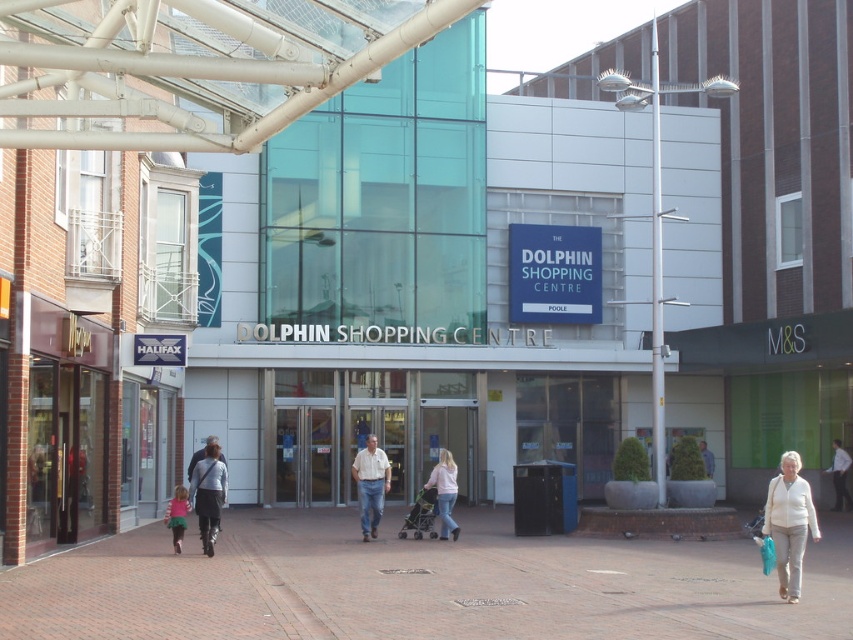
Can you confirm if light pink fabric stroller at center is wider than matte pink dress at lower left?

In fact, light pink fabric stroller at center might be narrower than matte pink dress at lower left.

Who is more forward, (439, 456) or (177, 547)?

Point (177, 547)

I want to click on light pink fabric stroller at center, so click(444, 492).

Is point (222, 484) closer to viewer compared to point (366, 540)?

Yes, point (222, 484) is closer to viewer.

From the picture: Can you confirm if dark gray sweater at lower left is positioned below light beige shirt at center?

Yes, dark gray sweater at lower left is below light beige shirt at center.

Does point (202, 468) come in front of point (381, 481)?

Yes, it is.

Find the location of a particular element. dark gray sweater at lower left is located at coordinates (207, 493).

Is point (799, 484) positioned after point (209, 540)?

No.

Is light beige sweater at lower right positioned before dark gray sweater at lower left?

Yes, it is in front of dark gray sweater at lower left.

This screenshot has width=853, height=640. Find the location of `light beige sweater at lower right`. light beige sweater at lower right is located at coordinates pos(788,524).